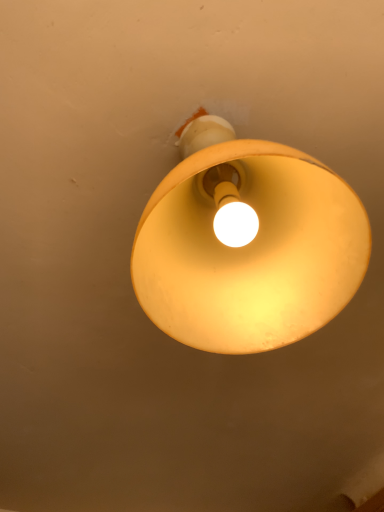
Where is `matte yellow lampshade at center`? The image size is (384, 512). matte yellow lampshade at center is located at coordinates (247, 244).

Describe the element at coordinates (247, 244) in the screenshot. This screenshot has height=512, width=384. I see `matte yellow lampshade at center` at that location.

You are a GUI agent. You are given a task and a screenshot of the screen. Output one action in this format:
    pyautogui.click(x=<x>, y=<y>)
    Task: Click on the matte yellow lampshade at center
    This screenshot has width=384, height=512.
    Given the screenshot: What is the action you would take?
    pyautogui.click(x=247, y=244)